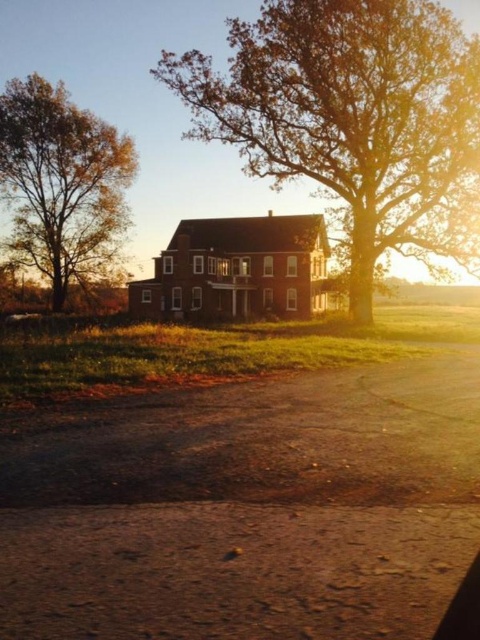
Who is shorter, golden brown bark tree at left or brown brick barn at center?

With less height is brown brick barn at center.

Which is behind, point (86, 273) or point (205, 230)?

The point (86, 273) is more distant.

Where is `golden brown bark tree at left`? golden brown bark tree at left is located at coordinates (61, 182).

Locate an element on the screen. golden brown bark tree at left is located at coordinates (61, 182).

Is dusty brown dirt track at lower center closer to the viewer compared to brown brick barn at center?

Yes, it is.

This screenshot has width=480, height=640. Find the location of `dusty brown dirt track at lower center`. dusty brown dirt track at lower center is located at coordinates (248, 508).

Is dusty brown dirt track at lower center further to camera compared to brown textured tree at center?

No.

Is point (147, 428) positioned behind point (409, 45)?

No, it is in front of (409, 45).

Who is more forward, (346, 618) or (456, 102)?

Point (346, 618) is more forward.

Image resolution: width=480 pixels, height=640 pixels. I want to click on dusty brown dirt track at lower center, so click(248, 508).